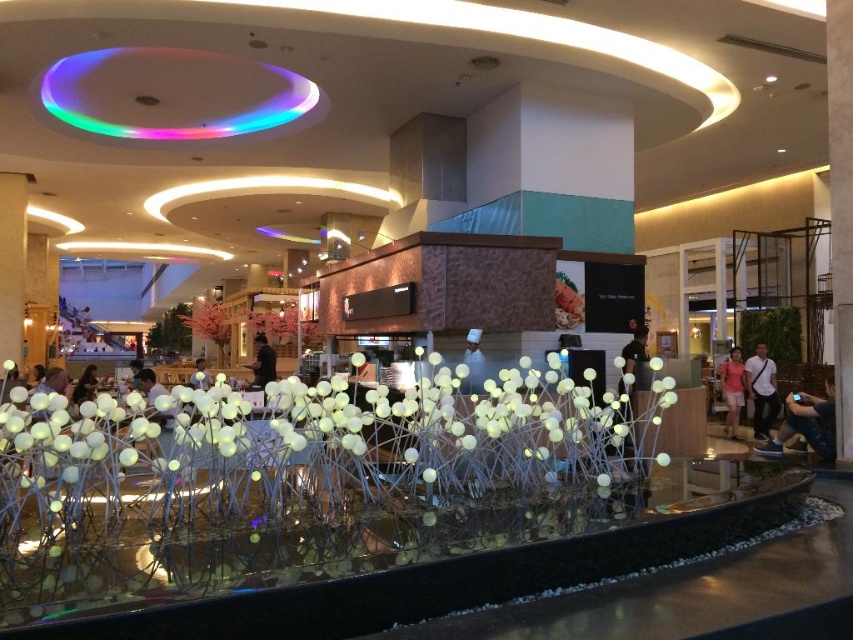
You are a photographer setting up a shoot in the food court. You have a pink matte flower at center and a matte black shirt at lower left in your frame. Which object should you focus on if you want to capture the larger subject?

The pink matte flower at center is bigger than the matte black shirt at lower left, so you should focus on the pink matte flower at center to capture the larger subject.

In the scene shown: You are a photographer setting up a shoot in the food court. You have a pink fabric dress at center and a pink matte flower at center in your frame. Which object will appear closer to the camera in the photo?

The pink fabric dress at center will appear closer to the camera because it is positioned in front of the pink matte flower at center.

Based on the photo, you are a customer looking to take a photo of the pink matte flower at center and the matte black shirt at lower left. Which object will appear larger in your camera viewfinder?

The pink matte flower at center will appear larger in your camera viewfinder because it is much taller than the matte black shirt at lower left.